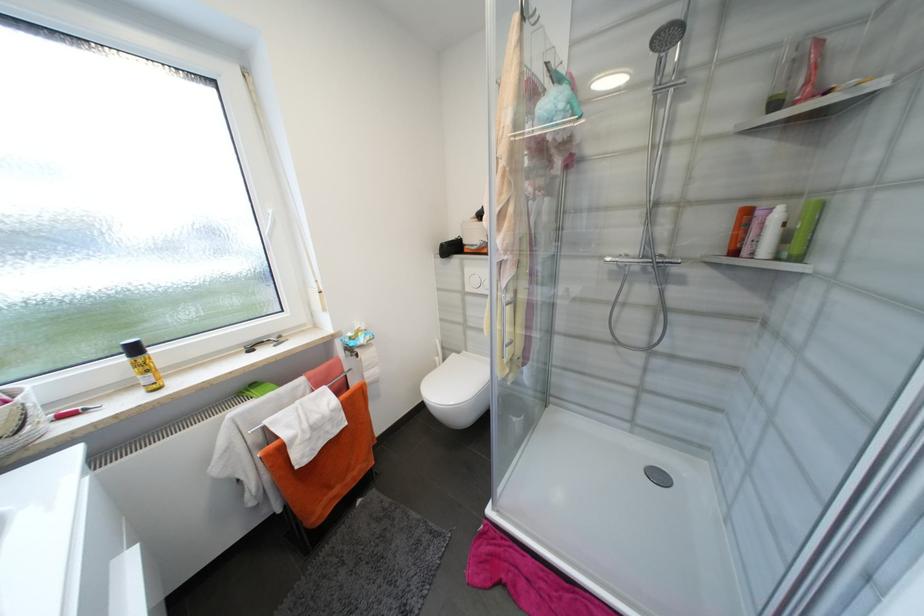
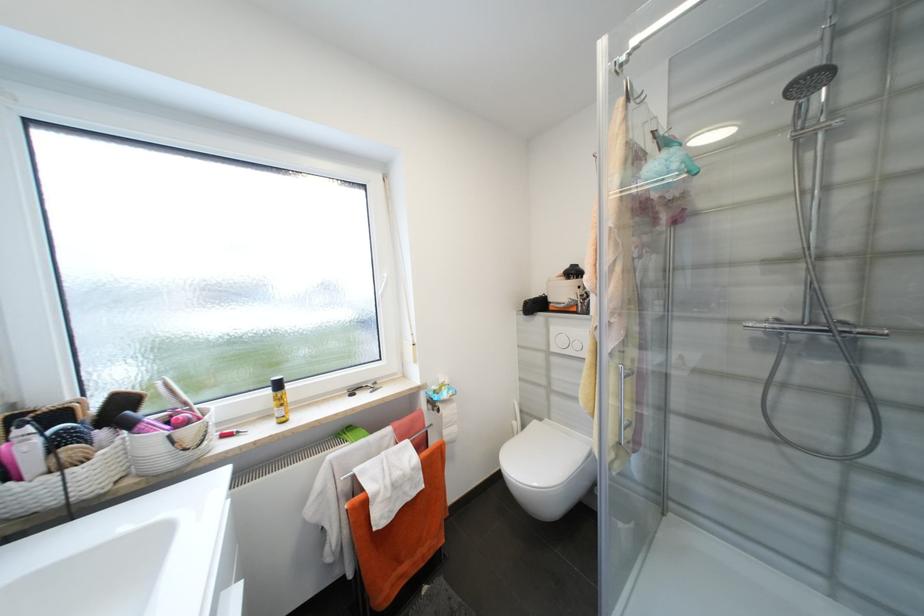
Question: I am providing you with two images of the same scene from different viewpoints. Please identify which objects are invisible in image2.

Choices:
 (A) blue bath sponge
 (B) toilet paper roll
 (C) shower door handle
 (D) none of these

Answer: (D)